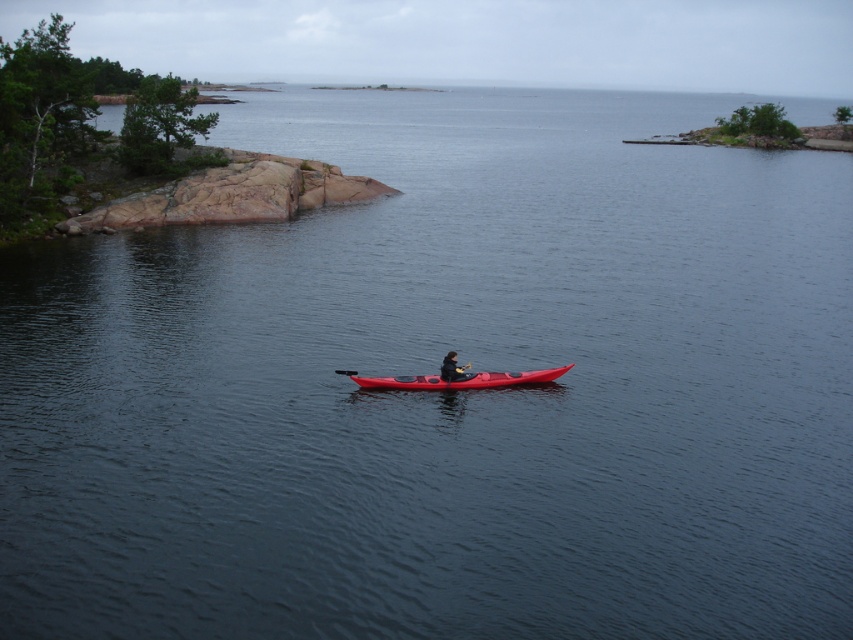
Does matte red kayak at center have a smaller size compared to dark gray fabric jacket at center?

No.

The image size is (853, 640). I want to click on matte red kayak at center, so click(456, 378).

Does point (431, 374) lie behind point (440, 371)?

Yes, point (431, 374) is behind point (440, 371).

I want to click on matte red kayak at center, so click(x=456, y=378).

Who is positioned more to the left, matte red canoe at center or dark gray fabric jacket at center?

dark gray fabric jacket at center

Who is shorter, matte red canoe at center or dark gray fabric jacket at center?

Standing shorter between the two is matte red canoe at center.

What are the coordinates of `matte red canoe at center` in the screenshot? It's located at (457, 380).

Is point (444, 378) closer to viewer compared to point (421, 387)?

Yes.

Is matte red kayak at center smaller than matte red canoe at center?

No.

Describe the element at coordinates (456, 378) in the screenshot. The image size is (853, 640). I see `matte red kayak at center` at that location.

The width and height of the screenshot is (853, 640). I want to click on matte red kayak at center, so click(456, 378).